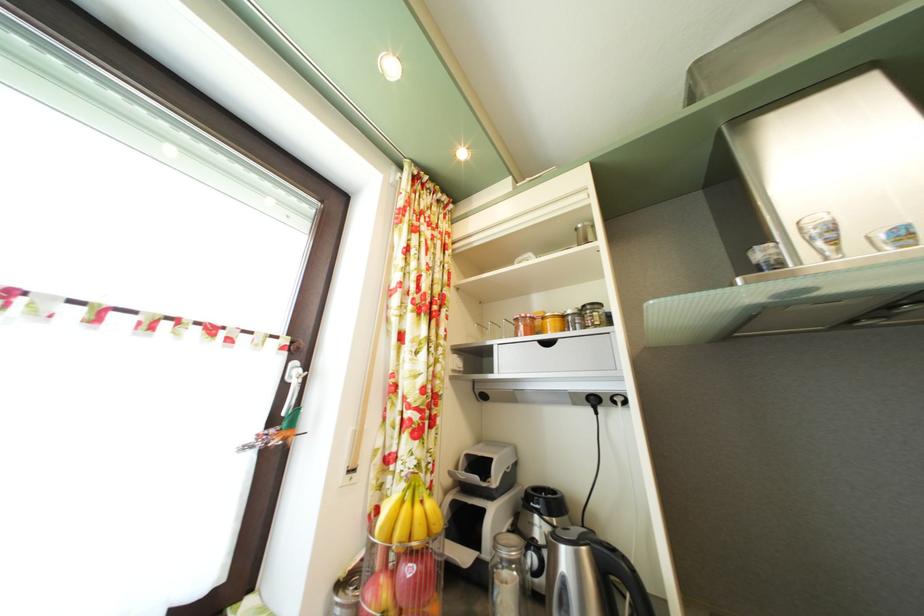
Find where to lift the blender pitcher. Please return your answer as a coordinate pair (x, y).

(589, 575)